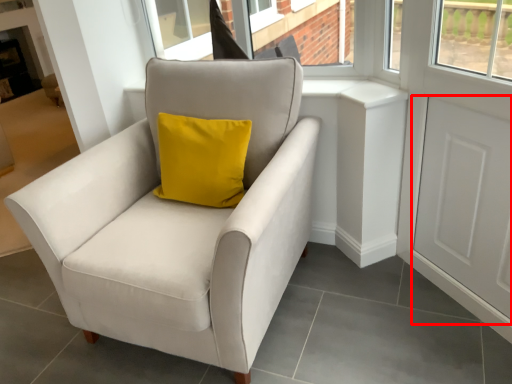
Question: Considering the relative positions of screen door (annotated by the red box) and chair in the image provided, where is screen door (annotated by the red box) located with respect to the staircase?

Choices:
 (A) left
 (B) right

Answer: (B)